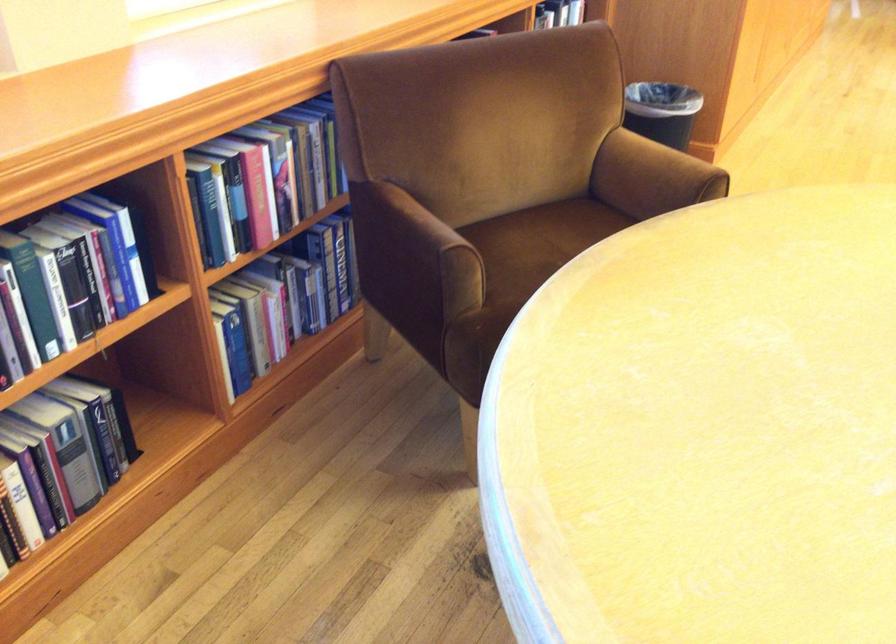
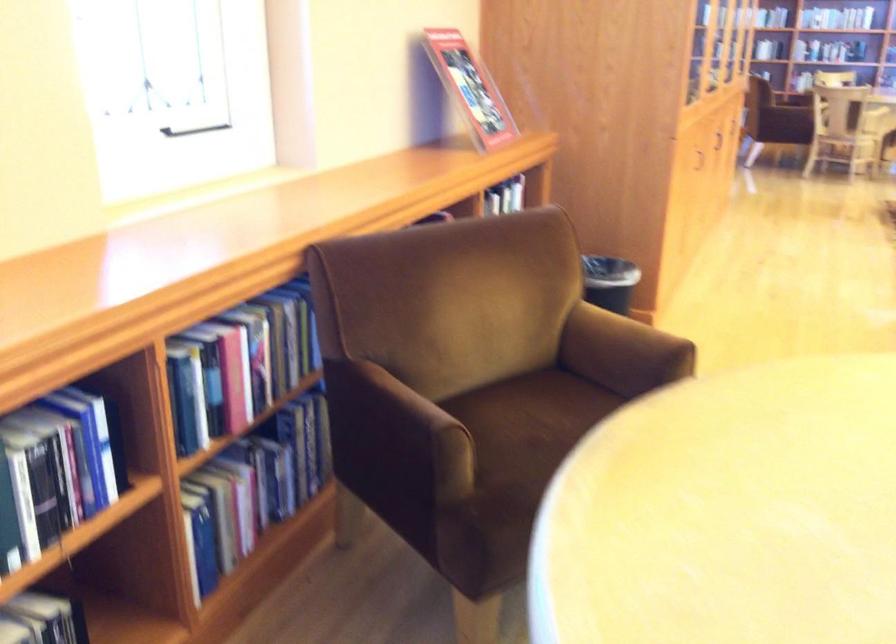
Find the pixel in the second image that matches (337,259) in the first image.

(306, 440)